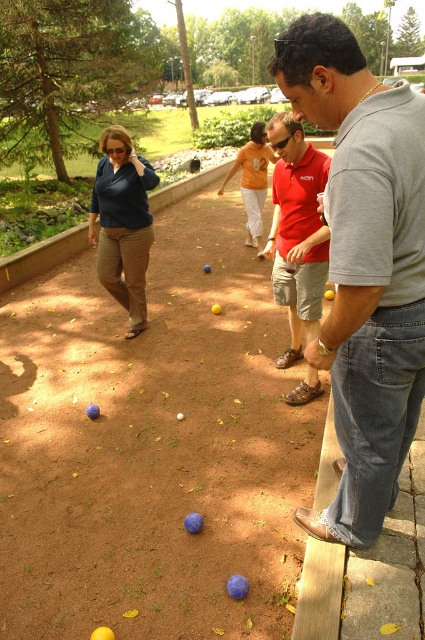
Looking at this image, is gray cotton shirt at center in front of matte red polo shirt at center?

That is True.

Is gray cotton shirt at center thinner than matte red polo shirt at center?

No.

Who is more forward, (x=407, y=193) or (x=295, y=164)?

Point (x=407, y=193)

Locate an element on the screen. The width and height of the screenshot is (425, 640). gray cotton shirt at center is located at coordinates (363, 266).

Can you confirm if gray cotton shirt at center is positioned to the right of orange cotton shirt at center?

Correct, you'll find gray cotton shirt at center to the right of orange cotton shirt at center.

Based on the photo, who is positioned more to the right, gray cotton shirt at center or orange cotton shirt at center?

Positioned to the right is gray cotton shirt at center.

Which is behind, point (379, 177) or point (263, 166)?

Point (263, 166)

What are the coordinates of `gray cotton shirt at center` in the screenshot? It's located at (363, 266).

Does matte red polo shirt at center have a larger size compared to orange cotton shirt at center?

No, matte red polo shirt at center is not bigger than orange cotton shirt at center.

Who is positioned more to the right, matte red polo shirt at center or orange cotton shirt at center?

matte red polo shirt at center is more to the right.

Which is behind, point (291, 161) or point (248, 150)?

Point (248, 150)

Locate an element on the screen. This screenshot has width=425, height=640. matte red polo shirt at center is located at coordinates (297, 230).